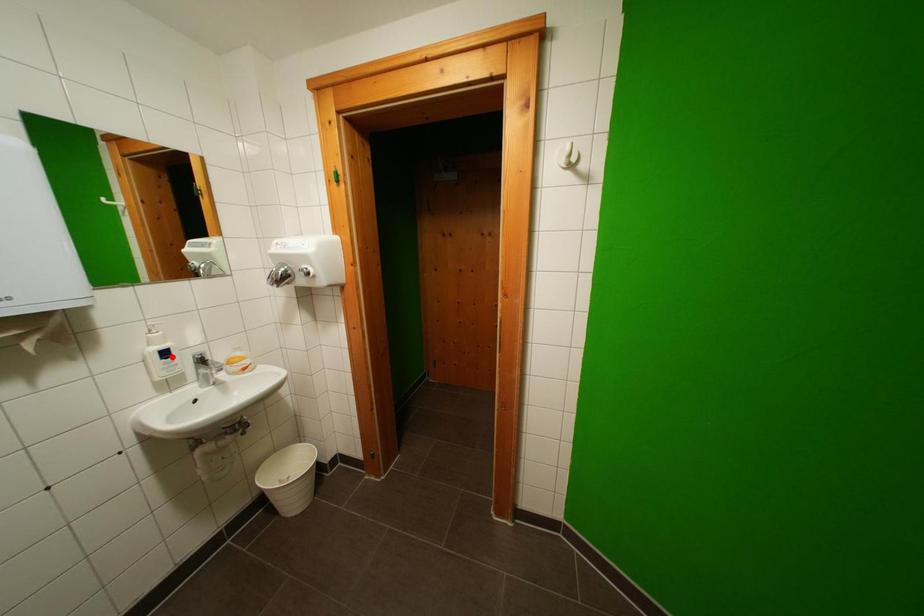
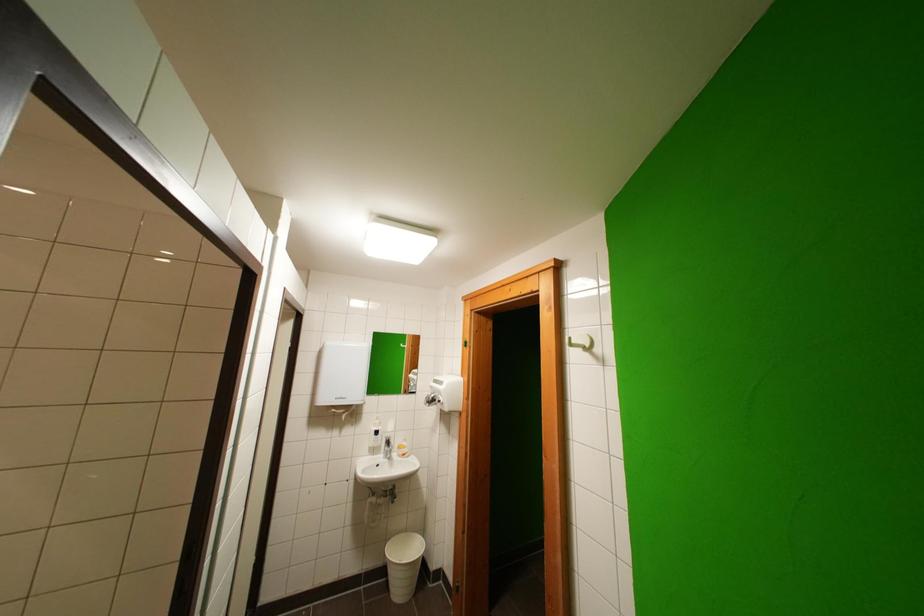
Question: I am providing you with two images of the same scene from different viewpoints. A red point is marked on the first image. Can you still see the location of the red point in image 2?

Choices:
 (A) Yes
 (B) No

Answer: (A)